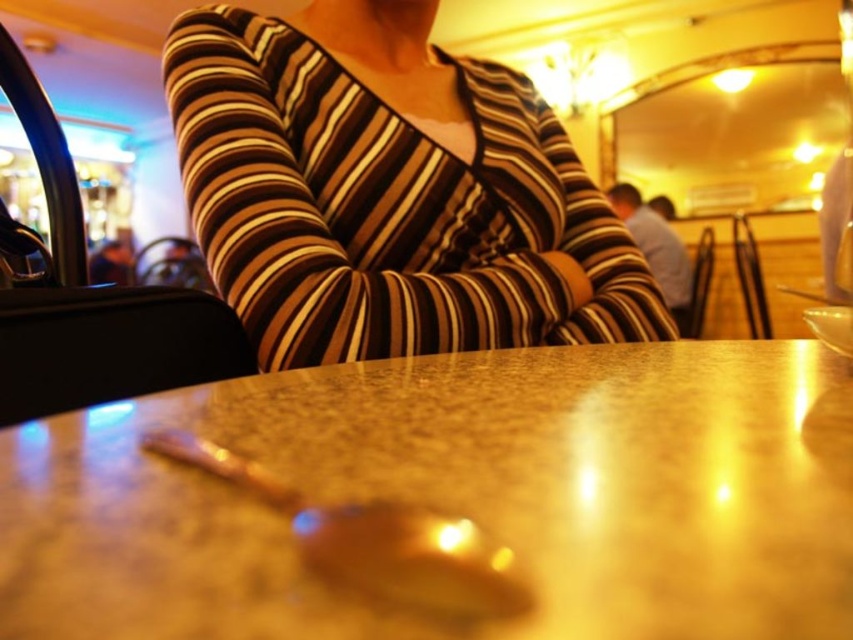
Question: Which point is closer to the camera?

Choices:
 (A) (506, 557)
 (B) (451, 112)

Answer: (A)

Question: Which of these objects is positioned farthest from the marble table at center?

Choices:
 (A) shiny metallic spoon at center
 (B) striped jersey at center

Answer: (B)

Question: Is marble table at center closer to the viewer compared to shiny metallic spoon at center?

Choices:
 (A) yes
 (B) no

Answer: (A)

Question: Is marble table at center behind striped jersey at center?

Choices:
 (A) yes
 (B) no

Answer: (B)

Question: Is marble table at center closer to camera compared to striped jersey at center?

Choices:
 (A) no
 (B) yes

Answer: (B)

Question: Which object is closer to the camera taking this photo?

Choices:
 (A) striped jersey at center
 (B) marble table at center

Answer: (B)